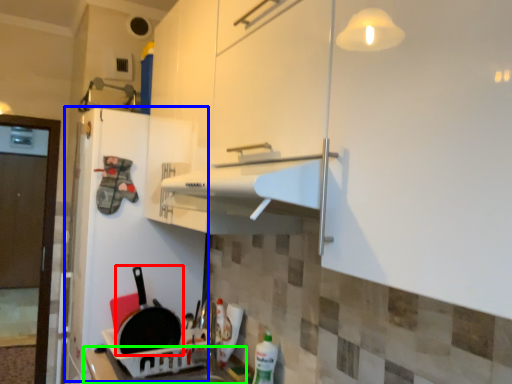
Question: Which object is positioned closest to frying pan (highlighted by a red box)? Select from fridge (highlighted by a blue box) and counter top (highlighted by a green box).

Choices:
 (A) fridge
 (B) counter top

Answer: (B)